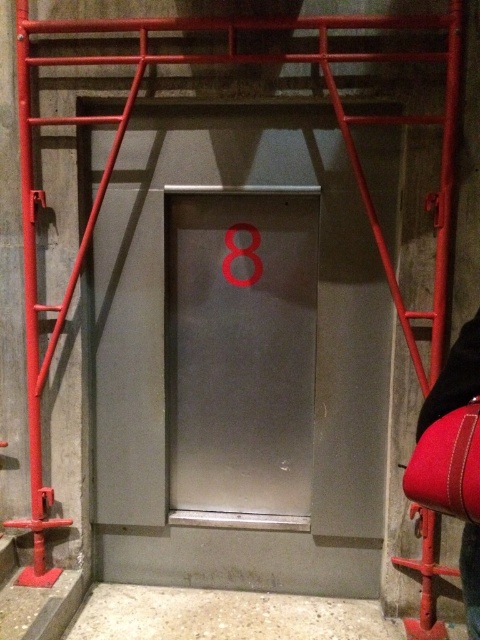
You are a delivery person carrying a large package that is 3 meters long. You are standing in front of the elevator and see the satin silver elevator door at center. Can you determine if your package will fit through the doorway?

The satin silver elevator door at center is 2.94 meters from viewer. Since your package is 3 meters long, it is slightly longer than the distance to the door, so it might not fit through the doorway.

You are a construction worker standing in front of the elevator door with the number 8. You need to locate your red leather pants. According to the image, where exactly are the red leather pants at lower right?

The red leather pants at lower right are located at point [455,378].

You are a delivery person with a box that requires a 6 feet clearance to maneuver safely. You see the red leather pants at lower right and the metallic number at center. Can you safely navigate between them with your box?

The distance between the red leather pants at lower right and the metallic number at center is 5.02 feet, which is less than the required 6 feet clearance. Therefore, you cannot safely navigate between them with your box.